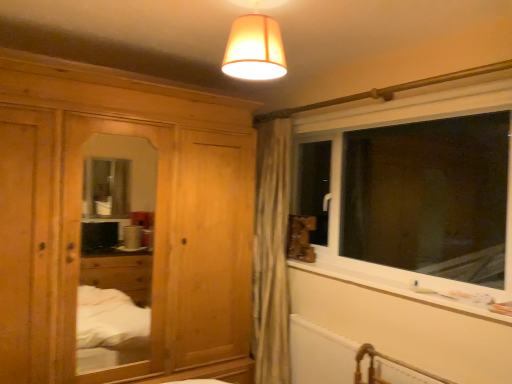
Question: Which is correct: matte orange fabric lampshade at upper center is inside white plastic window at right, or outside of it?

Choices:
 (A) inside
 (B) outside

Answer: (B)

Question: Considering the positions of point (269, 39) and point (300, 155), is point (269, 39) closer or farther from the camera than point (300, 155)?

Choices:
 (A) closer
 (B) farther

Answer: (A)

Question: Which is nearer to the matte orange fabric lampshade at upper center?

Choices:
 (A) white plastic window at right
 (B) white matte radiator at lower right
 (C) white plastic window sill at lower right
 (D) natural wood wardrobe at left

Answer: (D)

Question: Considering the real-world distances, which object is closest to the white matte radiator at lower right?

Choices:
 (A) matte orange fabric lampshade at upper center
 (B) white plastic window sill at lower right
 (C) white plastic window at right
 (D) natural wood wardrobe at left

Answer: (B)